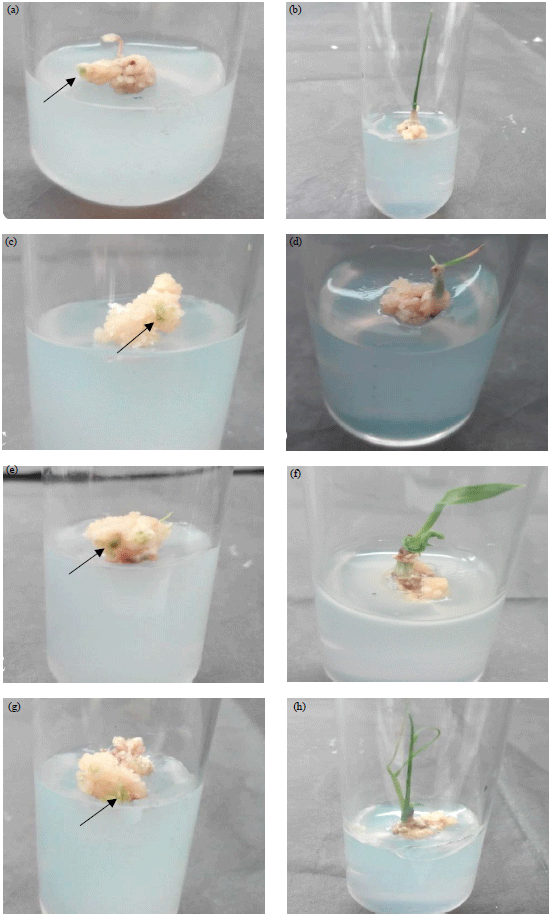
Where is `picture label`? picture label is located at coordinates (295, 704), (10, 706), (12, 467), (294, 475), (294, 243), (11, 9), (9, 244), (291, 7).